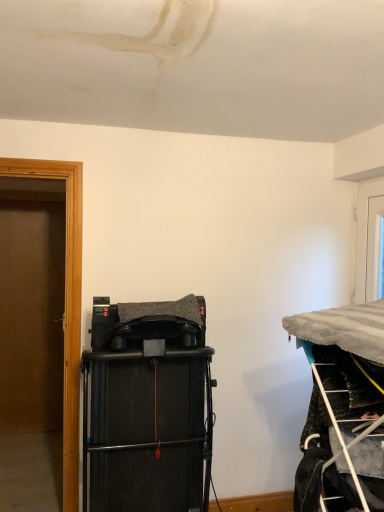
Question: Should I look upward or downward to see black matte speaker at center?

Choices:
 (A) down
 (B) up

Answer: (A)

Question: Is white glossy door at upper right next to metallic wire rack at right?

Choices:
 (A) yes
 (B) no

Answer: (B)

Question: Considering the relative positions of white glossy door at upper right and metallic wire rack at right in the image provided, is white glossy door at upper right to the right of metallic wire rack at right from the viewer's perspective?

Choices:
 (A) no
 (B) yes

Answer: (B)

Question: Does white glossy door at upper right appear on the left side of metallic wire rack at right?

Choices:
 (A) no
 (B) yes

Answer: (A)

Question: Is white glossy door at upper right not near metallic wire rack at right?

Choices:
 (A) yes
 (B) no

Answer: (A)

Question: From a real-world perspective, does white glossy door at upper right sit lower than metallic wire rack at right?

Choices:
 (A) no
 (B) yes

Answer: (A)

Question: Is white glossy door at upper right aimed at metallic wire rack at right?

Choices:
 (A) no
 (B) yes

Answer: (A)

Question: From the image's perspective, is white glossy door at upper right located above black matte speaker at center?

Choices:
 (A) yes
 (B) no

Answer: (A)

Question: From a real-world perspective, is white glossy door at upper right physically below black matte speaker at center?

Choices:
 (A) yes
 (B) no

Answer: (B)

Question: Can you confirm if white glossy door at upper right is thinner than black matte speaker at center?

Choices:
 (A) no
 (B) yes

Answer: (B)

Question: Is the surface of white glossy door at upper right in direct contact with black matte speaker at center?

Choices:
 (A) yes
 (B) no

Answer: (B)

Question: Is black matte speaker at center at the back of white glossy door at upper right?

Choices:
 (A) yes
 (B) no

Answer: (B)

Question: From a real-world perspective, is white glossy door at upper right on top of black matte speaker at center?

Choices:
 (A) no
 (B) yes

Answer: (B)

Question: Considering the relative positions of white plastic ladder at lower right and black matte speaker at center in the image provided, is white plastic ladder at lower right to the right of black matte speaker at center from the viewer's perspective?

Choices:
 (A) no
 (B) yes

Answer: (B)